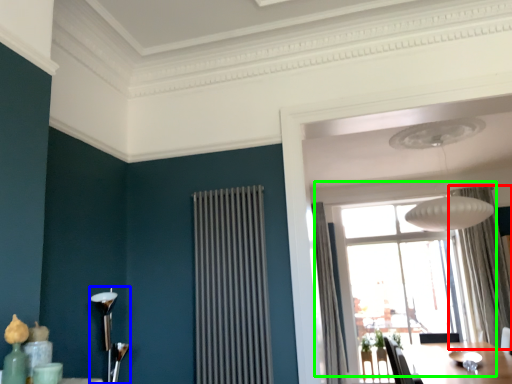
Question: Which object is positioned closest to curtain (highlighted by a red box)? Select from lamp (highlighted by a blue box) and window (highlighted by a green box).

Choices:
 (A) lamp
 (B) window

Answer: (B)